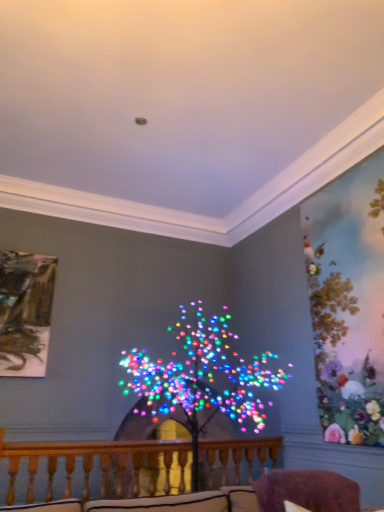
Question: Would you say purple fuzzy swivel chair at lower right is outside multicolored lights at center?

Choices:
 (A) yes
 (B) no

Answer: (A)

Question: Is purple fuzzy swivel chair at lower right looking in the opposite direction of multicolored lights at center?

Choices:
 (A) no
 (B) yes

Answer: (B)

Question: Is purple fuzzy swivel chair at lower right touching multicolored lights at center?

Choices:
 (A) yes
 (B) no

Answer: (B)

Question: Is multicolored lights at center inside purple fuzzy swivel chair at lower right?

Choices:
 (A) yes
 (B) no

Answer: (B)

Question: Can you confirm if purple fuzzy swivel chair at lower right is wider than multicolored lights at center?

Choices:
 (A) yes
 (B) no

Answer: (B)

Question: Relative to purple fuzzy swivel chair at lower right, is wooden at center in front or behind?

Choices:
 (A) front
 (B) behind

Answer: (B)

Question: From the image's perspective, is wooden at center above or below purple fuzzy swivel chair at lower right?

Choices:
 (A) below
 (B) above

Answer: (A)

Question: Which is correct: wooden at center is inside purple fuzzy swivel chair at lower right, or outside of it?

Choices:
 (A) inside
 (B) outside

Answer: (B)

Question: Considering the positions of wooden at center and purple fuzzy swivel chair at lower right in the image, is wooden at center bigger or smaller than purple fuzzy swivel chair at lower right?

Choices:
 (A) small
 (B) big

Answer: (B)

Question: Considering their positions, is purple fuzzy swivel chair at lower right located in front of or behind multicolored lights at center?

Choices:
 (A) behind
 (B) front

Answer: (B)

Question: Does point (263, 488) appear closer or farther from the camera than point (236, 372)?

Choices:
 (A) farther
 (B) closer

Answer: (B)

Question: In terms of width, does purple fuzzy swivel chair at lower right look wider or thinner when compared to multicolored lights at center?

Choices:
 (A) thin
 (B) wide

Answer: (A)

Question: Would you say purple fuzzy swivel chair at lower right is inside or outside multicolored lights at center?

Choices:
 (A) inside
 (B) outside

Answer: (B)

Question: Considering the positions of multicolored lights at center and wooden at center in the image, is multicolored lights at center taller or shorter than wooden at center?

Choices:
 (A) tall
 (B) short

Answer: (A)

Question: Does point (193, 345) appear closer or farther from the camera than point (233, 448)?

Choices:
 (A) farther
 (B) closer

Answer: (A)